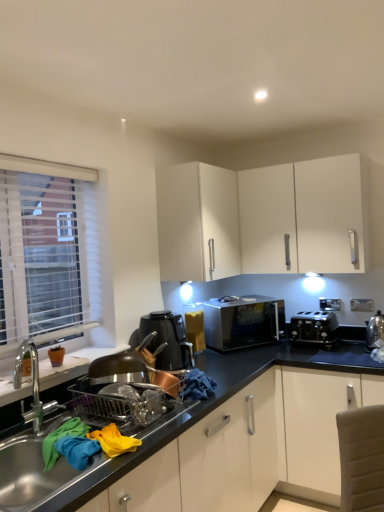
Question: Should I look upward or downward to see metallic stainless steel sink at lower left?

Choices:
 (A) down
 (B) up

Answer: (A)

Question: Considering the relative sizes of satin silver microwave at center and black plastic kettle at center in the image provided, is satin silver microwave at center bigger than black plastic kettle at center?

Choices:
 (A) yes
 (B) no

Answer: (A)

Question: Does satin silver microwave at center come behind black plastic kettle at center?

Choices:
 (A) no
 (B) yes

Answer: (B)

Question: Is satin silver microwave at center to the right of black plastic kettle at center from the viewer's perspective?

Choices:
 (A) no
 (B) yes

Answer: (B)

Question: From the image's perspective, would you say satin silver microwave at center is positioned over black plastic kettle at center?

Choices:
 (A) no
 (B) yes

Answer: (B)

Question: Is black plastic kettle at center inside satin silver microwave at center?

Choices:
 (A) no
 (B) yes

Answer: (A)

Question: Considering the relative sizes of satin silver microwave at center and black plastic kettle at center in the image provided, is satin silver microwave at center wider than black plastic kettle at center?

Choices:
 (A) no
 (B) yes

Answer: (A)

Question: Can metallic stainless steel sink at lower left be found inside satin silver kettle at right, which is the 2th appliance in left-to-right order?

Choices:
 (A) yes
 (B) no

Answer: (B)

Question: Is satin silver kettle at right, which ranks as the second appliance in back-to-front order, shorter than metallic stainless steel sink at lower left?

Choices:
 (A) no
 (B) yes

Answer: (B)

Question: Is satin silver kettle at right, which is the 2th appliance in left-to-right order, smaller than metallic stainless steel sink at lower left?

Choices:
 (A) no
 (B) yes

Answer: (B)

Question: Does satin silver kettle at right, acting as the 1th appliance starting from the right, have a greater height compared to metallic stainless steel sink at lower left?

Choices:
 (A) no
 (B) yes

Answer: (A)

Question: Considering the relative sizes of satin silver kettle at right, acting as the 1th appliance starting from the right, and metallic stainless steel sink at lower left in the image provided, is satin silver kettle at right, acting as the 1th appliance starting from the right, wider than metallic stainless steel sink at lower left?

Choices:
 (A) yes
 (B) no

Answer: (B)

Question: Considering the relative positions of satin silver kettle at right, which ranks as the second appliance in back-to-front order, and metallic stainless steel sink at lower left in the image provided, is satin silver kettle at right, which ranks as the second appliance in back-to-front order, behind metallic stainless steel sink at lower left?

Choices:
 (A) no
 (B) yes

Answer: (B)

Question: From a real-world perspective, is satin silver microwave at center on top of black plastic toaster at lower right, which is the second appliance in front-to-back order?

Choices:
 (A) no
 (B) yes

Answer: (B)